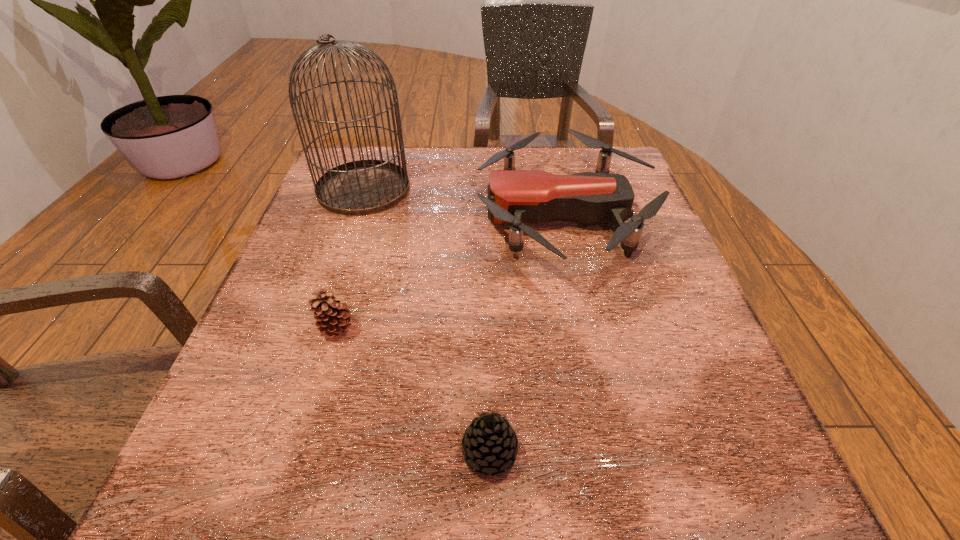
You are a GUI agent. You are given a task and a screenshot of the screen. Output one action in this format:
    pyautogui.click(x=<x>, y=<y>)
    Task: Click on the free spot that satisfies the following two spatial constraints: 1. on the front-facing side of the drone; 2. on the front side of the farther pinecone
    Image resolution: width=960 pixels, height=540 pixels.
    Given the screenshot: What is the action you would take?
    pyautogui.click(x=590, y=327)